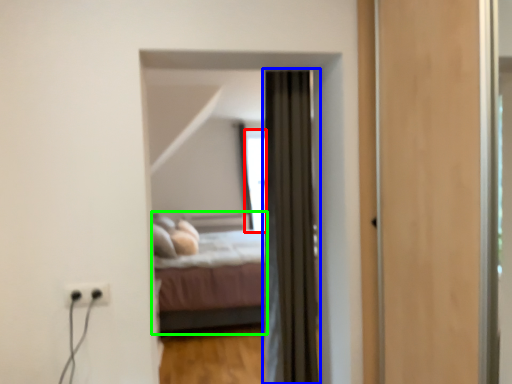
Question: Which is farther away from window (highlighted by a red box)? curtain (highlighted by a blue box) or bed (highlighted by a green box)?

Choices:
 (A) curtain
 (B) bed

Answer: (A)